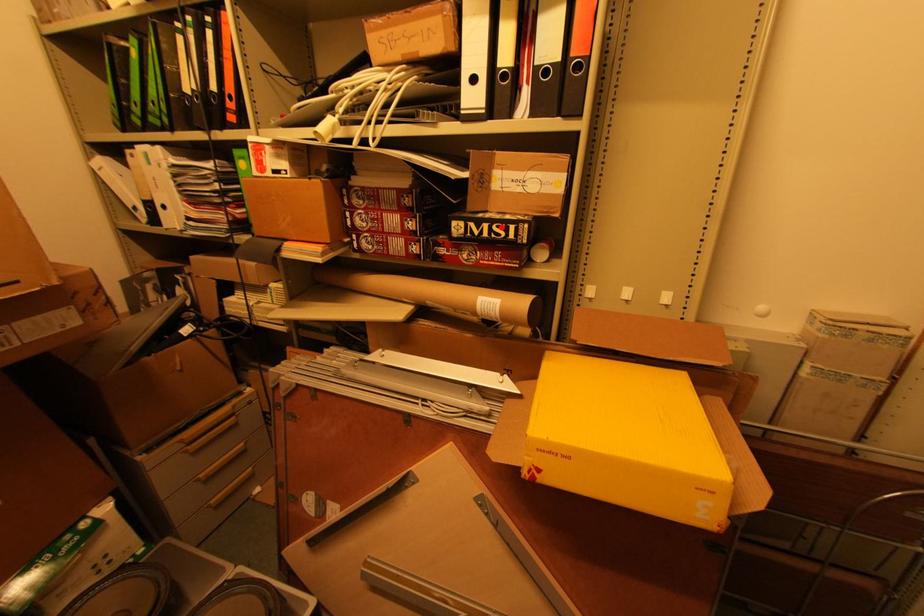
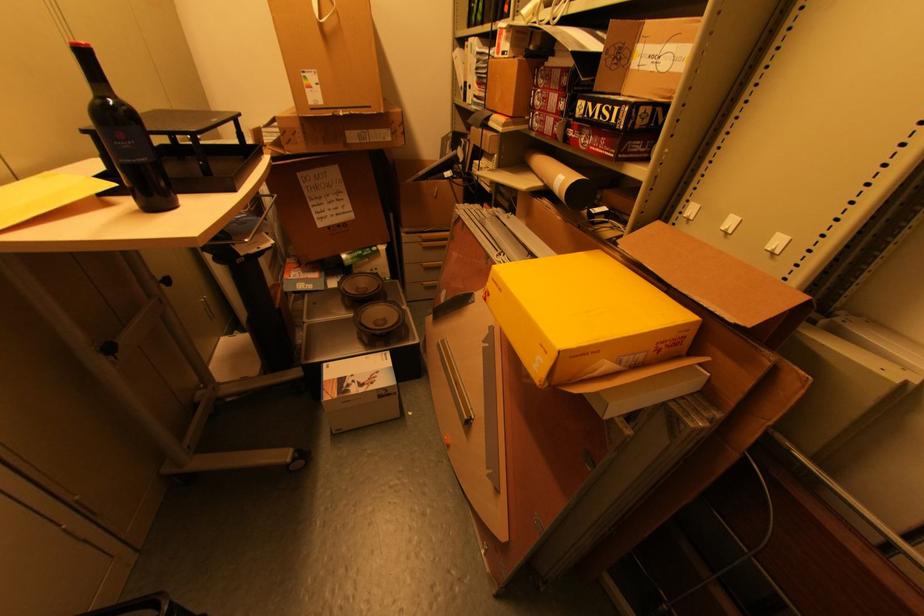
Where in the second image is the point corresponding to the highlighted location from the first image?

(610, 108)